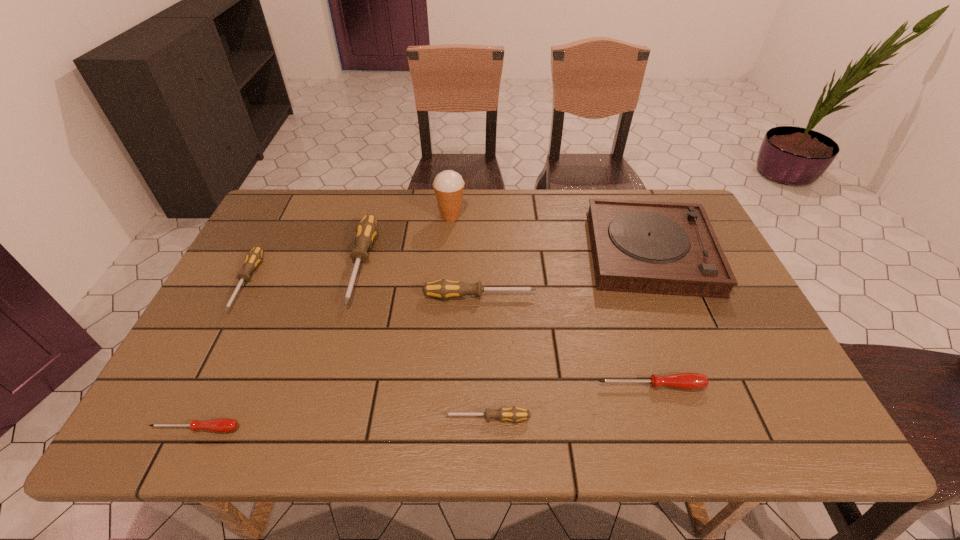
Locate an element on the screen. the tallest object is located at coordinates (448, 185).

I want to click on phonograph record, so click(667, 248).

The height and width of the screenshot is (540, 960). I want to click on the tallest screwdriver, so click(x=366, y=230).

I want to click on the fourth screwdriver from right to left, so click(x=366, y=230).

Where is `the second tallest screwdriver`? the second tallest screwdriver is located at coordinates (443, 289).

Find the location of a particular element. the third smallest gray screwdriver is located at coordinates (443, 289).

Where is `the second smallest gray screwdriver`? The width and height of the screenshot is (960, 540). the second smallest gray screwdriver is located at coordinates (253, 258).

What are the coordinates of `the rightmost screwdriver` in the screenshot? It's located at (690, 381).

This screenshot has height=540, width=960. I want to click on the right red screwdriver, so click(x=690, y=381).

This screenshot has height=540, width=960. Identify the location of the smallest gray screwdriver. (514, 414).